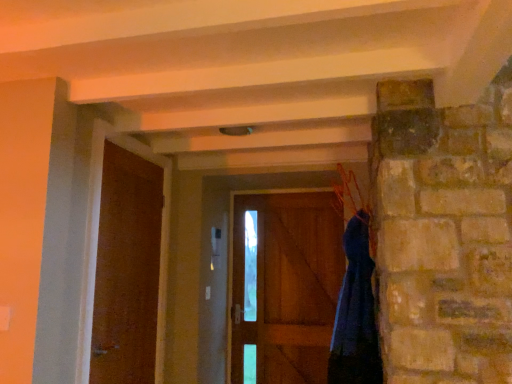
Question: Is blue fabric hanger at upper right shorter than brown wooden door at center, positioned as the first door in right-to-left order?

Choices:
 (A) no
 (B) yes

Answer: (B)

Question: Considering the relative sizes of blue fabric hanger at upper right and brown wooden door at center, placed as the 2th door when sorted from front to back, in the image provided, is blue fabric hanger at upper right smaller than brown wooden door at center, placed as the 2th door when sorted from front to back,?

Choices:
 (A) yes
 (B) no

Answer: (B)

Question: From a real-world perspective, is blue fabric hanger at upper right under brown wooden door at center, positioned as the first door in right-to-left order?

Choices:
 (A) no
 (B) yes

Answer: (A)

Question: Is blue fabric hanger at upper right bigger than brown wooden door at center, positioned as the first door in right-to-left order?

Choices:
 (A) no
 (B) yes

Answer: (B)

Question: Does blue fabric hanger at upper right lie in front of brown wooden door at center, positioned as the first door in right-to-left order?

Choices:
 (A) yes
 (B) no

Answer: (A)

Question: Is brown wooden door at center, arranged as the second door when viewed from the left, taller or shorter than dark blue fabric at right?

Choices:
 (A) short
 (B) tall

Answer: (B)

Question: In the image, is brown wooden door at center, placed as the 2th door when sorted from front to back, on the left side or the right side of dark blue fabric at right?

Choices:
 (A) right
 (B) left

Answer: (B)

Question: From a real-world perspective, is brown wooden door at center, arranged as the second door when viewed from the left, positioned above or below dark blue fabric at right?

Choices:
 (A) above
 (B) below

Answer: (A)

Question: Looking at the image, does brown wooden door at center, placed as the 2th door when sorted from front to back, seem bigger or smaller compared to dark blue fabric at right?

Choices:
 (A) small
 (B) big

Answer: (A)

Question: From a real-world perspective, relative to blue fabric hanger at upper right, is wooden door at left, which is counted as the first door, starting from the left, vertically above or below?

Choices:
 (A) below
 (B) above

Answer: (A)

Question: Does point (125, 334) appear closer or farther from the camera than point (356, 210)?

Choices:
 (A) closer
 (B) farther

Answer: (A)

Question: Looking at the image, does wooden door at left, which is counted as the first door, starting from the left, seem bigger or smaller compared to blue fabric hanger at upper right?

Choices:
 (A) small
 (B) big

Answer: (B)

Question: In terms of width, does wooden door at left, marked as the 1th door in a front-to-back arrangement, look wider or thinner when compared to blue fabric hanger at upper right?

Choices:
 (A) thin
 (B) wide

Answer: (A)

Question: In terms of size, does wooden door at left, positioned as the second door in right-to-left order, appear bigger or smaller than dark blue fabric at right?

Choices:
 (A) big
 (B) small

Answer: (A)

Question: In the image, is wooden door at left, which is the second door in back-to-front order, positioned in front of or behind dark blue fabric at right?

Choices:
 (A) front
 (B) behind

Answer: (A)